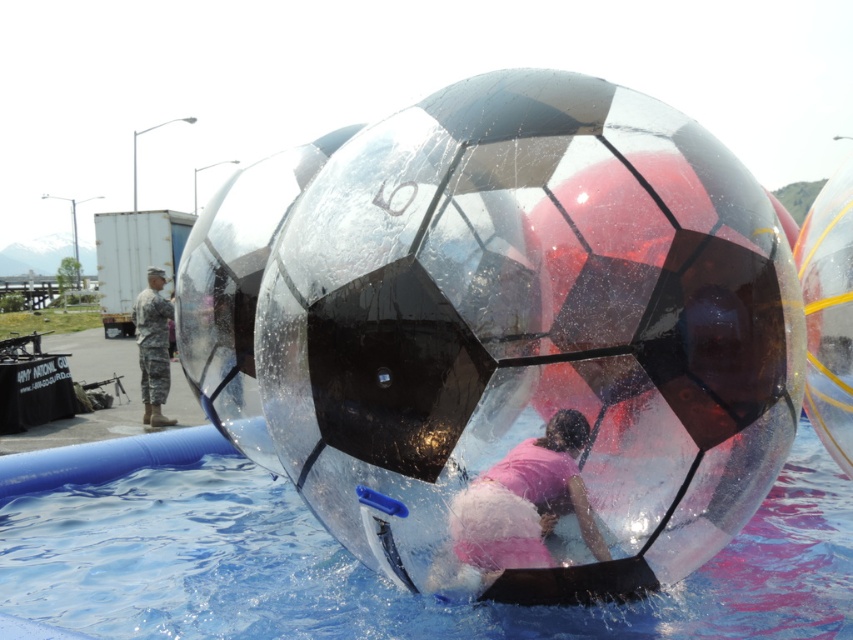
Can you confirm if pink matte shirt at center is thinner than camouflage uniform at left?

Yes, pink matte shirt at center is thinner than camouflage uniform at left.

Who is higher up, pink matte shirt at center or camouflage uniform at left?

camouflage uniform at left

Does point (560, 502) come farther from viewer compared to point (154, 410)?

No.

I want to click on pink matte shirt at center, so click(525, 500).

Consider the image. Who is more distant from viewer, (543, 108) or (544, 451)?

The point (543, 108) is behind.

How far apart are transparent plastic beach ball at center and pink matte shirt at center?

transparent plastic beach ball at center is 20.88 centimeters from pink matte shirt at center.

Is point (732, 198) in front of point (552, 513)?

No.

Locate an element on the screen. transparent plastic beach ball at center is located at coordinates click(x=508, y=324).

Can you confirm if transparent plastic beach ball at center is positioned to the left of transparent plastic pool at center?

In fact, transparent plastic beach ball at center is to the right of transparent plastic pool at center.

What do you see at coordinates (508, 324) in the screenshot? Image resolution: width=853 pixels, height=640 pixels. I see `transparent plastic beach ball at center` at bounding box center [508, 324].

Locate an element on the screen. Image resolution: width=853 pixels, height=640 pixels. transparent plastic beach ball at center is located at coordinates (508, 324).